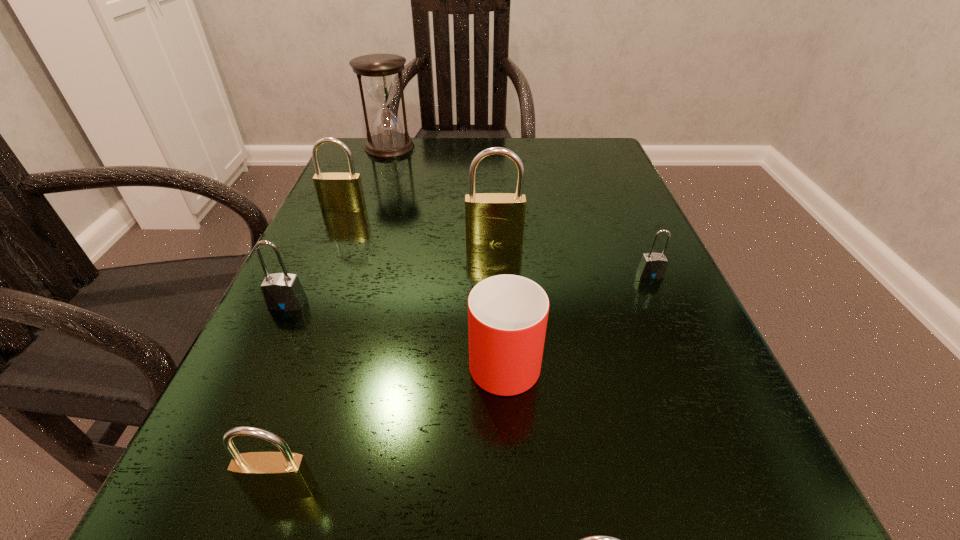
Locate an element on the screen. vacant space at the right edge of the desktop is located at coordinates (627, 262).

At what (x,y) coordinates should I click in order to perform the action: click on blank space at the far left corner of the desktop. Please return your answer as a coordinate pair (x, y). Looking at the image, I should click on (353, 140).

Locate an element on the screen. This screenshot has height=540, width=960. vacant space at the near left corner is located at coordinates (187, 496).

You are a GUI agent. You are given a task and a screenshot of the screen. Output one action in this format:
    pyautogui.click(x=<x>, y=<y>)
    Task: Click on the vacant space at the far right corner of the desktop
    This screenshot has width=960, height=540.
    Given the screenshot: What is the action you would take?
    pyautogui.click(x=617, y=170)

The image size is (960, 540). In the image, there is a desktop. Find the location of `free space at the near right corner`. free space at the near right corner is located at coordinates (723, 505).

Locate an element on the screen. vacant area that lies between the farthest brass padlock and the tallest padlock is located at coordinates (420, 224).

Locate an element on the screen. Image resolution: width=960 pixels, height=540 pixels. vacant area between the farthest object and the cup is located at coordinates (447, 251).

Find the location of a particular element. free point between the fifth shortest padlock and the fifth farthest padlock is located at coordinates (313, 349).

Where is `free spot between the seventh nearest object and the second nearest padlock`? free spot between the seventh nearest object and the second nearest padlock is located at coordinates (313, 349).

I want to click on free spot between the seventh nearest object and the farthest object, so click(x=367, y=178).